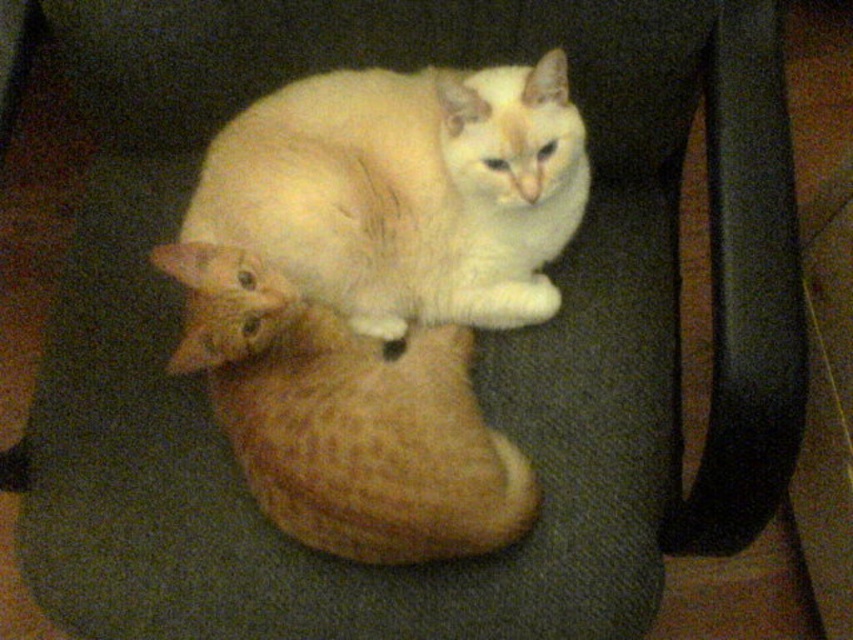
Question: Which point is closer to the camera taking this photo?

Choices:
 (A) (520, 248)
 (B) (349, 484)

Answer: (B)

Question: Can you confirm if soft cream fur cat at center is smaller than white fluffy cat at center?

Choices:
 (A) no
 (B) yes

Answer: (A)

Question: Is soft cream fur cat at center further to camera compared to white fluffy cat at center?

Choices:
 (A) yes
 (B) no

Answer: (B)

Question: Does soft cream fur cat at center appear under white fluffy cat at center?

Choices:
 (A) yes
 (B) no

Answer: (B)